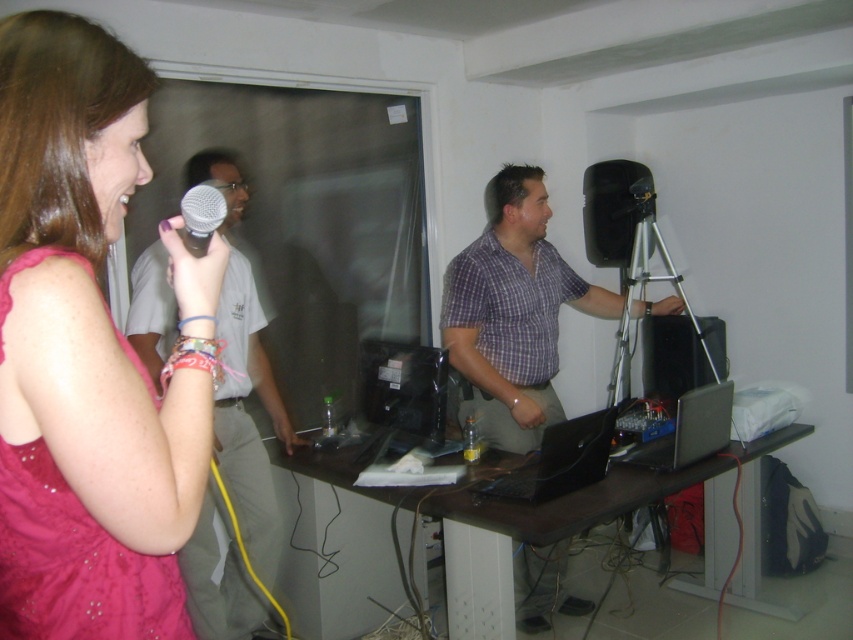
Question: Does light gray shirt at center appear on the left side of brown wooden table at center?

Choices:
 (A) no
 (B) yes

Answer: (B)

Question: Which object appears closest to the camera in this image?

Choices:
 (A) light gray shirt at center
 (B) silver metallic laptop at lower right
 (C) black plastic speaker at center

Answer: (A)

Question: Is pink satin dress at upper left above brown wooden table at center?

Choices:
 (A) no
 (B) yes

Answer: (B)

Question: Among these objects, which one is nearest to the camera?

Choices:
 (A) plaid shirt at center
 (B) silver metallic microphone at upper left
 (C) silver metallic laptop at lower right

Answer: (B)

Question: Which is nearer to the pink satin dress at upper left?

Choices:
 (A) black matte speaker at center
 (B) silver metallic laptop at lower right
 (C) black glossy monitor at center

Answer: (C)

Question: Is black glossy monitor at center closer to the viewer compared to silver metallic microphone at upper left?

Choices:
 (A) yes
 (B) no

Answer: (B)